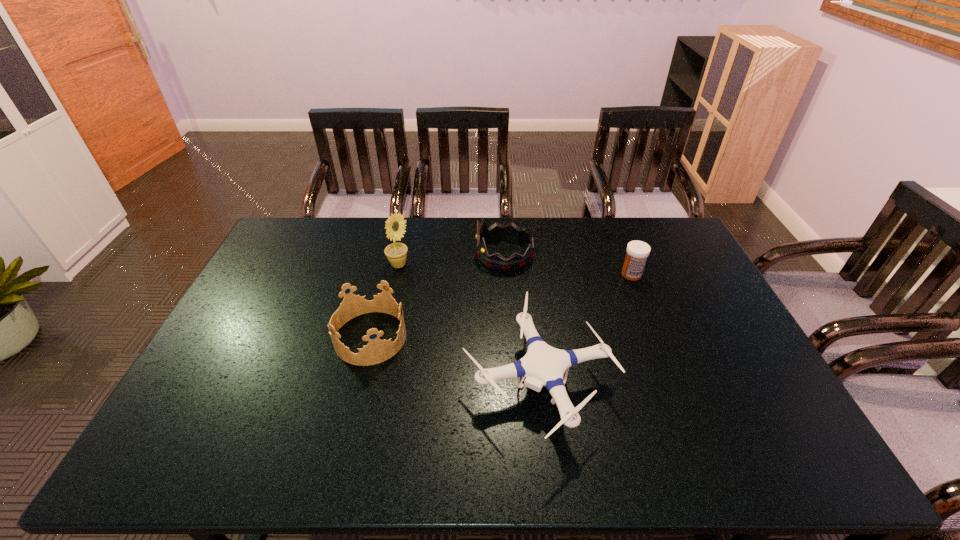
You are a GUI agent. You are given a task and a screenshot of the screen. Output one action in this format:
    pyautogui.click(x=<x>, y=<y>)
    Task: Click on the vacant space that is in between the sunflower and the drone
    
    Given the screenshot: What is the action you would take?
    pyautogui.click(x=468, y=323)

You are a GUI agent. You are given a task and a screenshot of the screen. Output one action in this format:
    pyautogui.click(x=<x>, y=<y>)
    Task: Click on the free space between the drone and the left tiara
    This screenshot has width=960, height=540.
    Given the screenshot: What is the action you would take?
    pyautogui.click(x=453, y=359)

Identify the location of free space between the rightmost object and the drone. Image resolution: width=960 pixels, height=540 pixels. (585, 328).

Locate an element on the screen. The height and width of the screenshot is (540, 960). empty space between the farther tiara and the nearer tiara is located at coordinates (437, 296).

The height and width of the screenshot is (540, 960). I want to click on vacant area that lies between the left tiara and the medicine, so click(x=500, y=306).

Find the location of `free spot between the tallest object and the drone`. free spot between the tallest object and the drone is located at coordinates (468, 323).

At what (x,y) coordinates should I click in order to perform the action: click on vacant area that lies between the drone and the sunflower. Please return your answer as a coordinate pair (x, y). This screenshot has width=960, height=540. Looking at the image, I should click on (468, 323).

The image size is (960, 540). Identify the location of object that is the third closest to the right tiara. (377, 351).

Point out which object is positioned as the nearest to the right tiara. Please provide its 2D coordinates. Your answer should be formatted as a tuple, i.e. [(x, y)], where the tuple contains the x and y coordinates of a point satisfying the conditions above.

[(543, 365)]

Identify the location of free space that satisfies the following two spatial constraints: 1. on the face of the tallest object; 2. on the left side of the rightmost object. This screenshot has height=540, width=960. (396, 274).